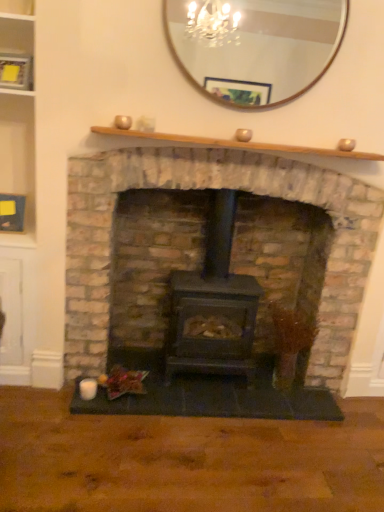
Question: Does wooden mirror at upper center have a larger size compared to matte black wood stove at center?

Choices:
 (A) yes
 (B) no

Answer: (B)

Question: Considering the relative positions of wooden mirror at upper center and matte black wood stove at center in the image provided, is wooden mirror at upper center to the right of matte black wood stove at center from the viewer's perspective?

Choices:
 (A) yes
 (B) no

Answer: (A)

Question: Is the position of wooden mirror at upper center less distant than that of matte black wood stove at center?

Choices:
 (A) yes
 (B) no

Answer: (B)

Question: Is wooden mirror at upper center further to the viewer compared to matte black wood stove at center?

Choices:
 (A) no
 (B) yes

Answer: (B)

Question: Can matte black wood stove at center be found inside wooden mirror at upper center?

Choices:
 (A) yes
 (B) no

Answer: (B)

Question: Considering their positions, is black matte wood burning stove at center located in front of or behind wooden mirror at upper center?

Choices:
 (A) front
 (B) behind

Answer: (B)

Question: Is point (241, 329) closer or farther from the camera than point (195, 64)?

Choices:
 (A) farther
 (B) closer

Answer: (A)

Question: Looking at their shapes, would you say black matte wood burning stove at center is wider or thinner than wooden mirror at upper center?

Choices:
 (A) thin
 (B) wide

Answer: (B)

Question: Is black matte wood burning stove at center situated inside wooden mirror at upper center or outside?

Choices:
 (A) inside
 (B) outside

Answer: (B)

Question: In terms of size, does matte black wood stove at center appear bigger or smaller than wooden shelf at upper center?

Choices:
 (A) small
 (B) big

Answer: (B)

Question: Considering the relative positions of matte black wood stove at center and wooden shelf at upper center in the image provided, is matte black wood stove at center to the left or to the right of wooden shelf at upper center?

Choices:
 (A) right
 (B) left

Answer: (B)

Question: Is matte black wood stove at center situated inside wooden shelf at upper center or outside?

Choices:
 (A) outside
 (B) inside

Answer: (A)

Question: Is point (276, 177) closer or farther from the camera than point (180, 139)?

Choices:
 (A) farther
 (B) closer

Answer: (A)

Question: From a real-world perspective, is wooden mirror at upper center physically located above or below matte black wood stove at center?

Choices:
 (A) below
 (B) above

Answer: (B)

Question: Is wooden mirror at upper center wider or thinner than matte black wood stove at center?

Choices:
 (A) thin
 (B) wide

Answer: (A)